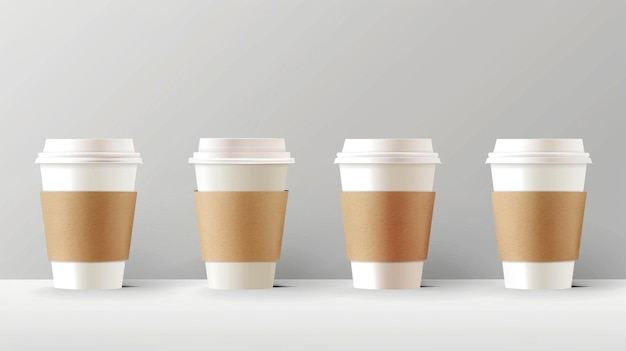
Locate an element on the screen. The width and height of the screenshot is (626, 351). cups is located at coordinates (96, 149), (223, 143), (377, 150), (539, 153).